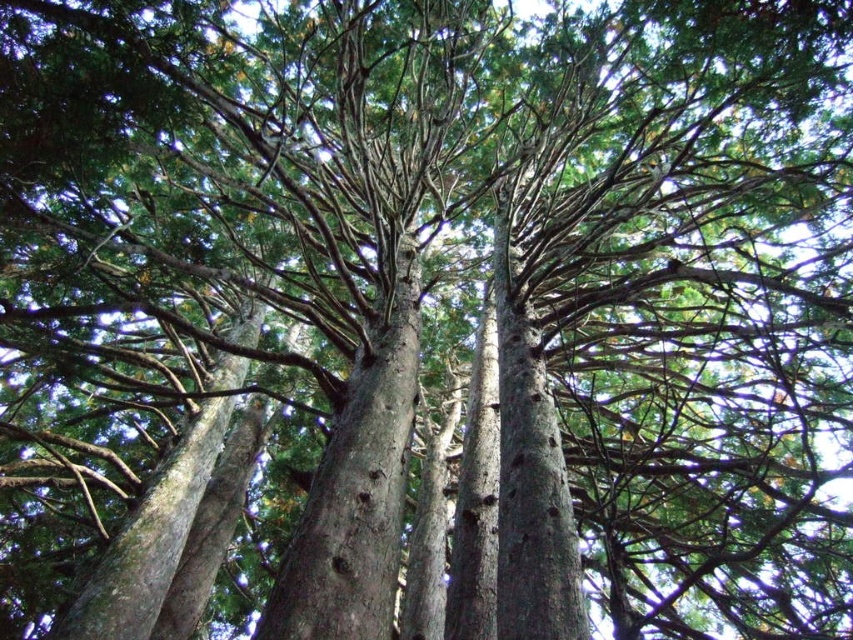
Question: Considering the relative positions of smooth bark tree trunk at center and smooth gray bark at center in the image provided, where is smooth bark tree trunk at center located with respect to smooth gray bark at center?

Choices:
 (A) above
 (B) below

Answer: (A)

Question: Does smooth bark tree trunk at center have a smaller size compared to smooth gray bark at center?

Choices:
 (A) yes
 (B) no

Answer: (A)

Question: Which of the following is the farthest from the observer?

Choices:
 (A) (236, 364)
 (B) (305, 604)

Answer: (A)

Question: Can you confirm if smooth bark tree trunk at center is positioned to the left of smooth gray bark at center?

Choices:
 (A) yes
 (B) no

Answer: (B)

Question: Which object is closer to the camera taking this photo?

Choices:
 (A) smooth bark tree trunk at center
 (B) smooth gray bark at center

Answer: (A)